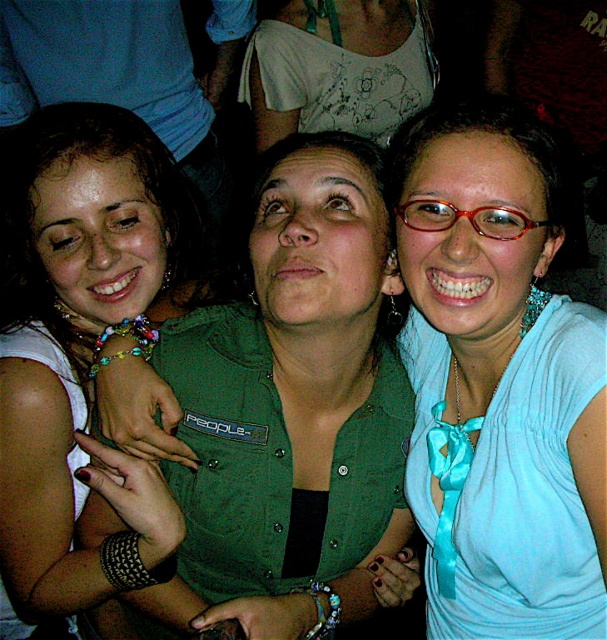
Question: Does teal satin ribbon at lower right appear on the right side of translucent red glasses at center?

Choices:
 (A) yes
 (B) no

Answer: (A)

Question: Among these points, which one is farthest from the camera?

Choices:
 (A) pyautogui.click(x=439, y=554)
 (B) pyautogui.click(x=274, y=356)
 (C) pyautogui.click(x=160, y=561)
 (D) pyautogui.click(x=472, y=211)

Answer: (A)

Question: Estimate the real-world distances between objects in this image. Which object is farther from the translucent red glasses at center?

Choices:
 (A) teal satin ribbon at lower right
 (B) matte blue blouse at center
 (C) green button-up shirt at center

Answer: (A)

Question: Which of the following is the closest to the observer?

Choices:
 (A) (463, 292)
 (B) (438, 468)
 (C) (435, 227)
 (D) (205, 502)

Answer: (A)

Question: Is green button-up shirt at center smaller than teal satin ribbon at lower right?

Choices:
 (A) no
 (B) yes

Answer: (A)

Question: Does teal satin ribbon at lower right have a smaller size compared to translucent red glasses at center?

Choices:
 (A) no
 (B) yes

Answer: (A)